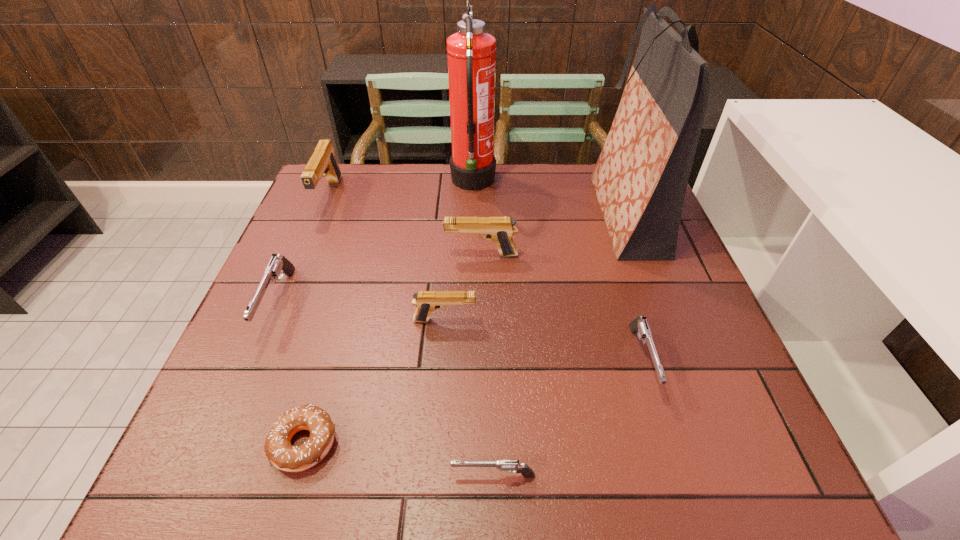
The image size is (960, 540). What are the coordinates of `empty location between the doughnut and the red fire extinguisher` in the screenshot? It's located at (389, 313).

I want to click on free space between the shortest object and the rightmost silver pistol, so click(473, 402).

Locate which object ranks fifth in proximity to the shopping bag. Please provide its 2D coordinates. Your answer should be formatted as a tuple, i.e. [(x, y)], where the tuple contains the x and y coordinates of a point satisfying the conditions above.

[(511, 466)]

Where is `the third closest object to the second nearest tan pistol`? the third closest object to the second nearest tan pistol is located at coordinates (640, 179).

Locate which pistol ranks fifth in proximity to the second silver pistol from right to left. Please provide its 2D coordinates. Your answer should be formatted as a tuple, i.e. [(x, y)], where the tuple contains the x and y coordinates of a point satisfying the conditions above.

[(322, 163)]

The height and width of the screenshot is (540, 960). In order to click on pistol that is the fifth closest one to the second tallest pistol in this screenshot , I will do `click(511, 466)`.

Select which tan pistol appears as the second closest to the nearest tan pistol. Please provide its 2D coordinates. Your answer should be formatted as a tuple, i.e. [(x, y)], where the tuple contains the x and y coordinates of a point satisfying the conditions above.

[(322, 163)]

Locate an element on the screen. This screenshot has height=540, width=960. tan pistol that stands as the second closest to the seventh object from right to left is located at coordinates (500, 230).

Identify the location of the third closest silver pistol relative to the seventh object from right to left. (639, 325).

The height and width of the screenshot is (540, 960). What are the coordinates of `silver pistol that is the second closest to the nearest pistol` in the screenshot? It's located at (278, 265).